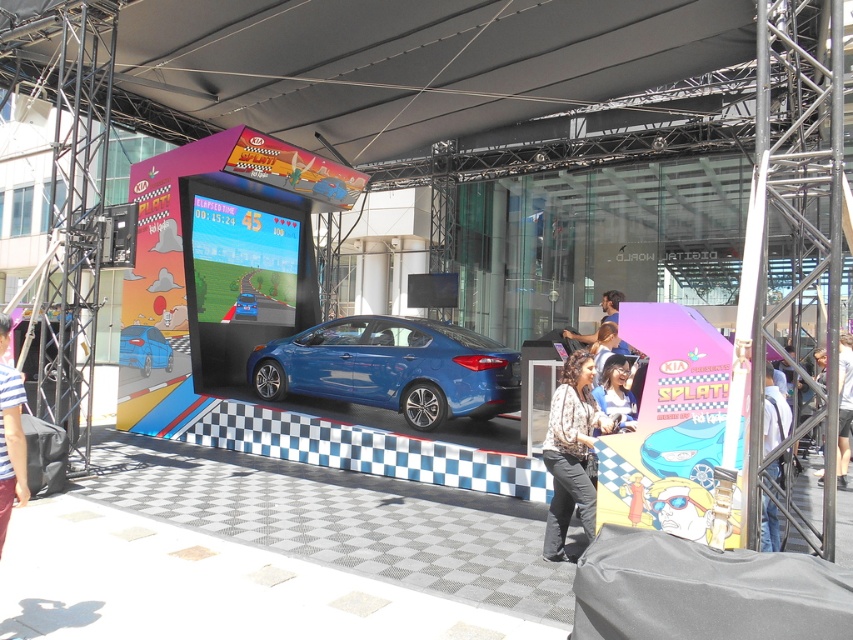
Is the position of blue fabric at center less distant than that of smooth skin at center?

Yes, blue fabric at center is in front of smooth skin at center.

Between point (625, 419) and point (614, 307), which one is positioned in front?

Point (625, 419) is more forward.

Does point (628, 422) lie behind point (607, 296)?

That is False.

The width and height of the screenshot is (853, 640). What are the coordinates of `blue fabric at center` in the screenshot? It's located at (616, 392).

From the picture: Which of these two, shiny blue car at center or white fabric at center, stands shorter?

shiny blue car at center

Can you confirm if shiny blue car at center is shorter than white fabric at center?

Yes.

Between point (149, 356) and point (844, 362), which one is positioned behind?

The point (149, 356) is more distant.

The width and height of the screenshot is (853, 640). I want to click on shiny blue car at center, so click(x=144, y=348).

Is white fabric bag at lower right to the left of shiny blue car at center from the viewer's perspective?

Incorrect, white fabric bag at lower right is not on the left side of shiny blue car at center.

I want to click on white fabric bag at lower right, so click(773, 412).

Is point (779, 470) closer to camera compared to point (123, 358)?

Yes, it is in front of point (123, 358).

I want to click on white fabric bag at lower right, so click(773, 412).